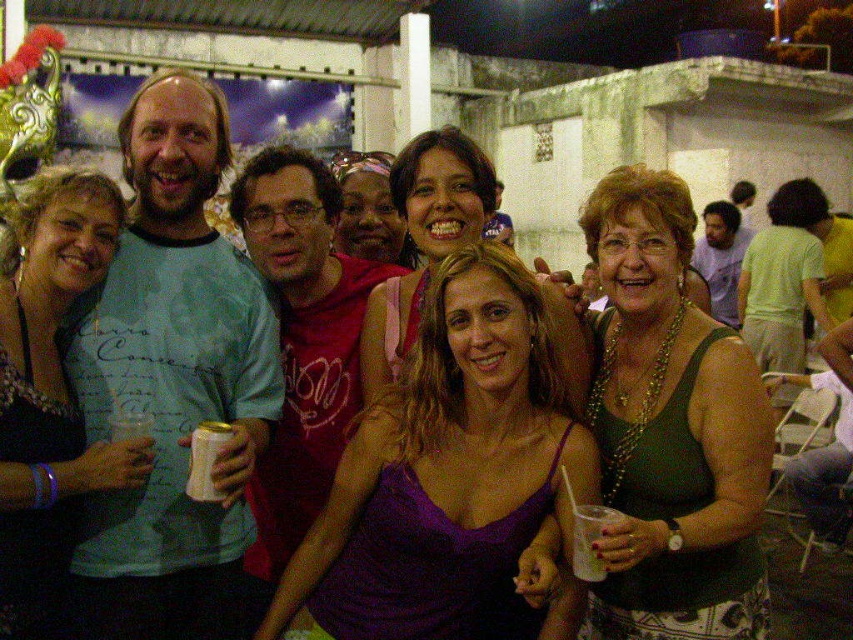
Question: Which is nearer to the green fabric tank top at center-right?

Choices:
 (A) matte black dress at center
 (B) matte red shirt at center

Answer: (B)

Question: Can you confirm if matte black dress at center is positioned to the left of clear plastic cup at lower right?

Choices:
 (A) no
 (B) yes

Answer: (B)

Question: Does purple fabric tank top at center appear on the right side of matte red shirt at center?

Choices:
 (A) no
 (B) yes

Answer: (B)

Question: Which point is farther from the camera taking this photo?

Choices:
 (A) (274, 208)
 (B) (223, 499)
 (C) (508, 296)

Answer: (A)

Question: Which of the following is the closest to the observer?

Choices:
 (A) (373, 378)
 (B) (79, 464)

Answer: (B)

Question: Is purple satin tank top at center thinner than smooth skin face at center?

Choices:
 (A) no
 (B) yes

Answer: (A)